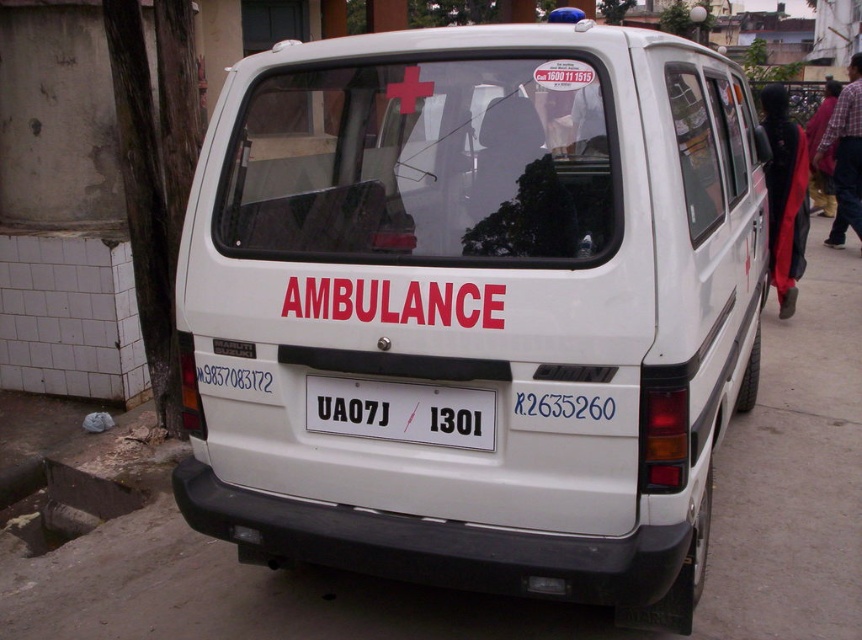
You are a delivery driver who needs to park your truck behind the white matte van at center. The parking space is only 2 meters long. Can you park your truck there if the white plastic license plate at center is 0.5 meters from the end of the van?

The white matte van at center is larger than the white plastic license plate at center. Since the license plate is 0.5 meters from the end of the van, the total length of the van plus this distance is more than 2 meters. Therefore, the parking space is insufficient for your truck.

You are a delivery person trying to park your van in a parking spot that is exactly the same width as the white plastic license plate at center. Can your white matte van at center fit into this parking spot?

The white matte van at center is wider than the white plastic license plate at center, so it cannot fit into a parking spot that matches the license plate width.